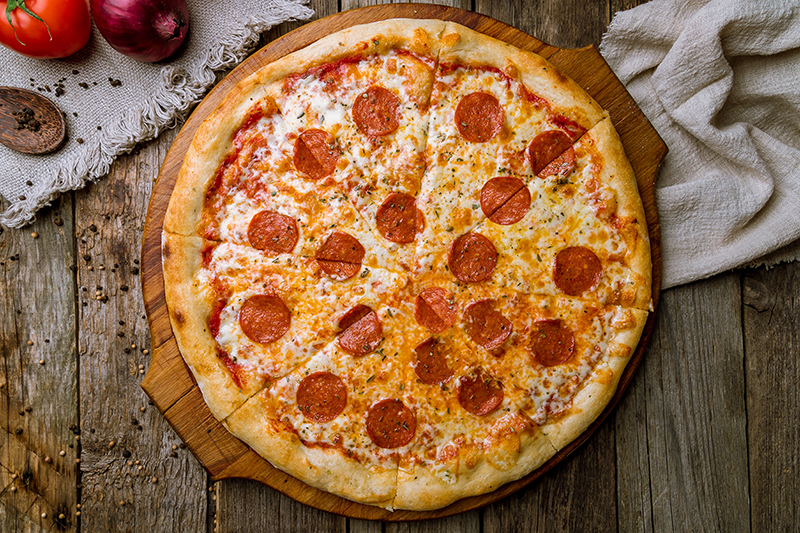
Image resolution: width=800 pixels, height=533 pixels. Identify the location of vertical wood planks. (42, 435), (134, 461), (268, 508), (433, 523), (536, 514), (670, 482), (765, 448).